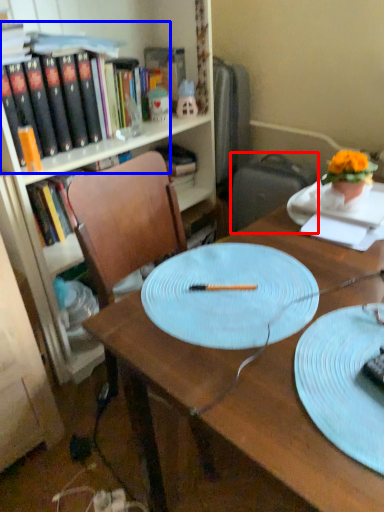
Question: Which of the following is the closest to the observer, suitcase (highlighted by a red box) or book (highlighted by a blue box)?

Choices:
 (A) suitcase
 (B) book

Answer: (B)